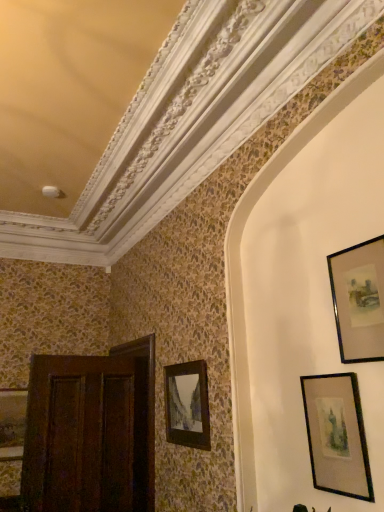
Question: Considering the relative positions of dark wood door at left and wooden picture frame at center, which is counted as the 3th picture frame, starting from the right, in the image provided, is dark wood door at left to the left or to the right of wooden picture frame at center, which is counted as the 3th picture frame, starting from the right,?

Choices:
 (A) right
 (B) left

Answer: (B)

Question: In terms of height, does dark wood door at left look taller or shorter compared to wooden picture frame at center, which is counted as the 3th picture frame, starting from the front?

Choices:
 (A) tall
 (B) short

Answer: (A)

Question: Which object is the farthest from the matte black picture frame at left, which is the 1th picture frame from left to right?

Choices:
 (A) black glossy picture frame at upper right, marked as the 4th picture frame in a bottom-to-top arrangement
 (B) dark wood door at left
 (C) wooden picture frame at center, which is counted as the 3th picture frame, starting from the top
 (D) black matte picture frame at lower right, the 2th picture frame from the right

Answer: (A)

Question: Which object is the closest to the dark wood door at left?

Choices:
 (A) black glossy picture frame at upper right, the 4th picture frame viewed from the back
 (B) wooden picture frame at center, which is counted as the 3th picture frame, starting from the right
 (C) black matte picture frame at lower right, placed as the third picture frame when sorted from left to right
 (D) matte black picture frame at left, marked as the fourth picture frame in a top-to-bottom arrangement

Answer: (B)